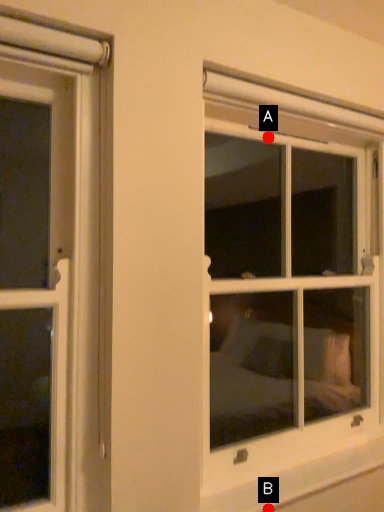
Question: Two points are circled on the image, labeled by A and B beside each circle. Which point appears closest to the camera in this image?

Choices:
 (A) A is closer
 (B) B is closer

Answer: (B)